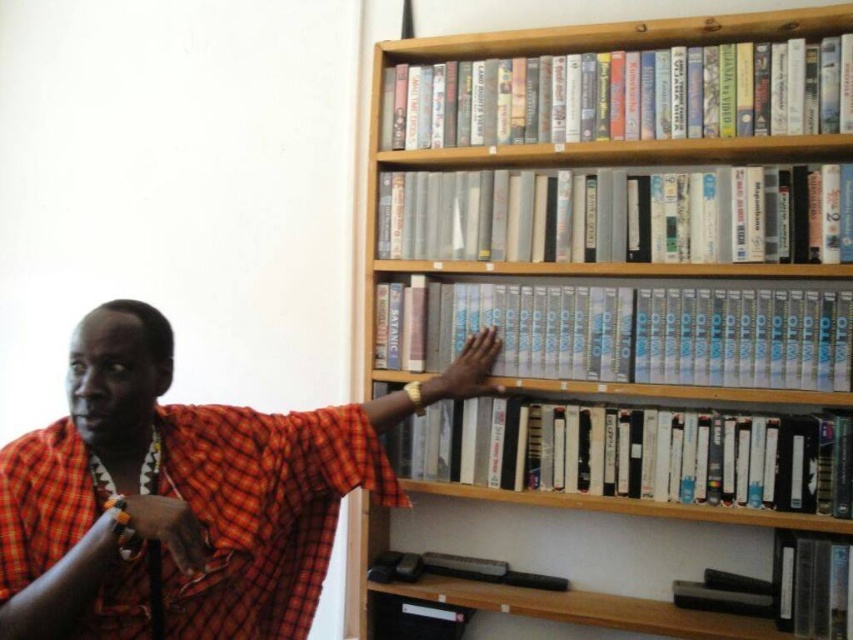
Question: Is wooden bookshelf at upper right wider than white glossy book at upper center?

Choices:
 (A) yes
 (B) no

Answer: (A)

Question: Where is wooden bookshelf at upper right located in relation to smooth skin hand at center in the image?

Choices:
 (A) left
 (B) right

Answer: (B)

Question: Which object appears farthest from the camera in this image?

Choices:
 (A) smooth skin hand at center
 (B) white plastic cassette at center
 (C) white glossy book at center

Answer: (A)

Question: Can you confirm if white glossy book at center is positioned to the left of smooth orange cloth at lower left?

Choices:
 (A) yes
 (B) no

Answer: (B)

Question: Estimate the real-world distances between objects in this image. Which object is farther from the white glossy book at center?

Choices:
 (A) wooden bookshelf at upper right
 (B) white plastic cassette at center

Answer: (A)

Question: Which object is the closest to the wooden bookshelf at upper right?

Choices:
 (A) orange checkered cloth at upper right
 (B) white plastic book at center

Answer: (B)